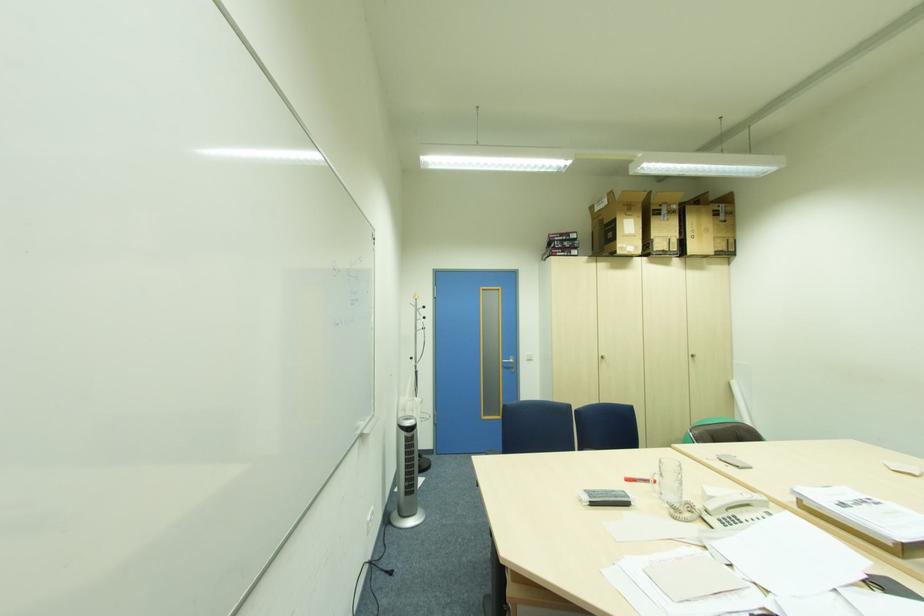
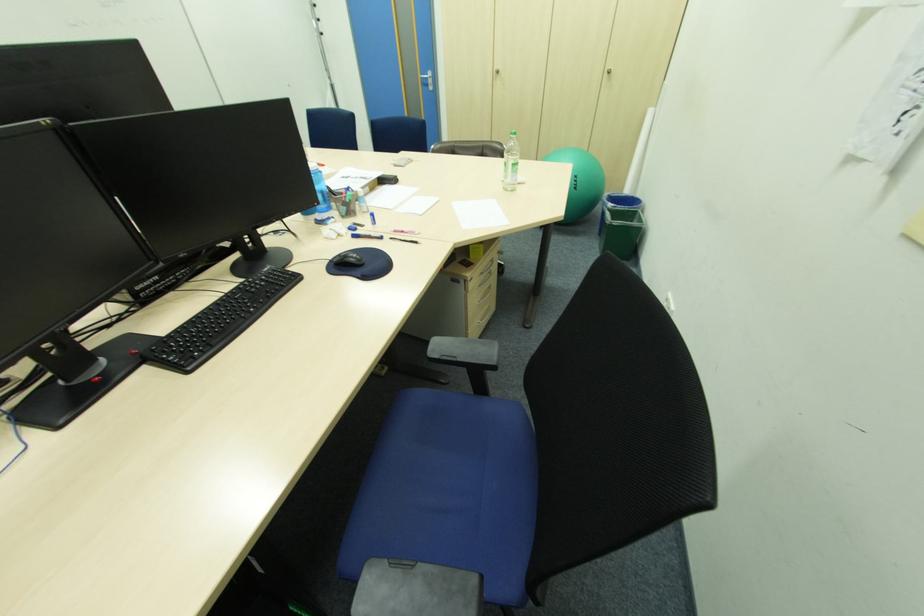
Where in the second image is the point corresponding to point 508,363 from the first image?

(428, 79)